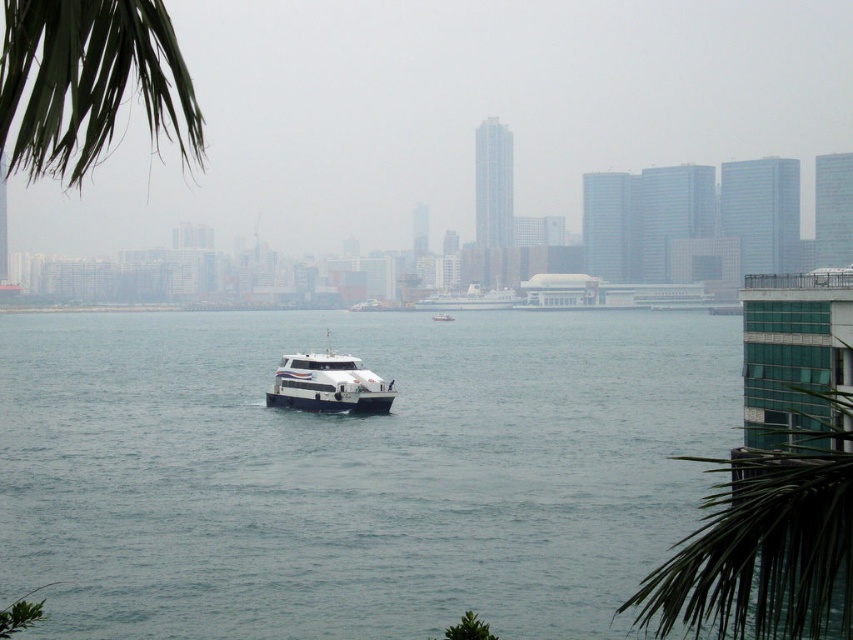
Is clear water at center to the left of green leafy palm tree at upper left from the viewer's perspective?

Incorrect, clear water at center is not on the left side of green leafy palm tree at upper left.

Can you confirm if clear water at center is bigger than green leafy palm tree at upper left?

Actually, clear water at center might be smaller than green leafy palm tree at upper left.

Does point (166, 544) come behind point (141, 33)?

That is True.

Where is `clear water at center`? clear water at center is located at coordinates point(352,470).

Is point (805, 556) positioned after point (427, 304)?

No.

Locate an element on the screen. This screenshot has height=640, width=853. green leafy palm tree at lower right is located at coordinates (766, 540).

Describe the element at coordinates (766, 540) in the screenshot. I see `green leafy palm tree at lower right` at that location.

Which is in front, point (770, 522) or point (79, 17)?

Point (79, 17) is in front.

Is point (637, 605) positioned behind point (115, 4)?

Yes, it is.

You are a GUI agent. You are given a task and a screenshot of the screen. Output one action in this format:
    pyautogui.click(x=<x>, y=<y>)
    Task: Click on the green leafy palm tree at lower right
    Image resolution: width=853 pixels, height=640 pixels.
    Given the screenshot: What is the action you would take?
    pyautogui.click(x=766, y=540)